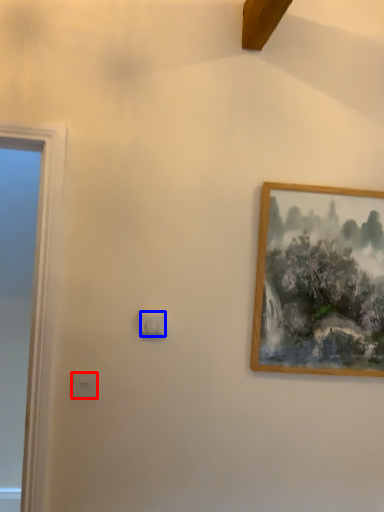
Question: Among these objects, which one is farthest to the camera, light switch (highlighted by a red box) or light switch (highlighted by a blue box)?

Choices:
 (A) light switch
 (B) light switch

Answer: (B)